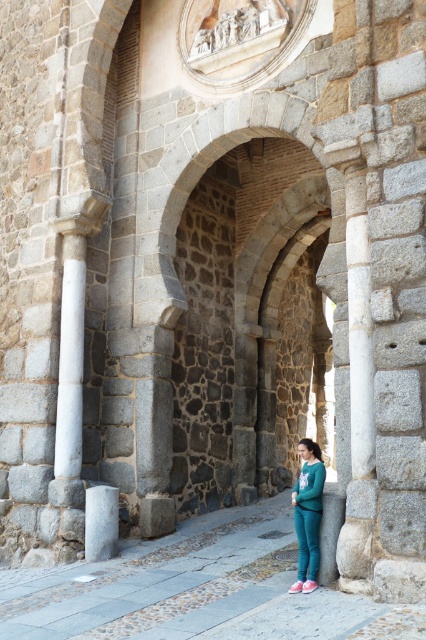
You are standing in front of the historic stone archway. You notice a point marked at coordinates (307, 515). What object is located at this point?

The point at (307, 515) marks the teal fleece pants at lower right.

Based on the photo, you are standing in front of the historic stone archway and notice two items in the scene. One is teal fleece pants at lower right and the other is gray stone pillar at center. From your perspective, which item is positioned more to the east?

The teal fleece pants at lower right is positioned to the right of the gray stone pillar at center, so from your perspective facing the archway, the teal fleece pants at lower right would be more to the east if you are facing north. However, without knowing the exact orientation of the archway, it is impossible to determine the absolute direction. The question might need more context about the archway orientation.